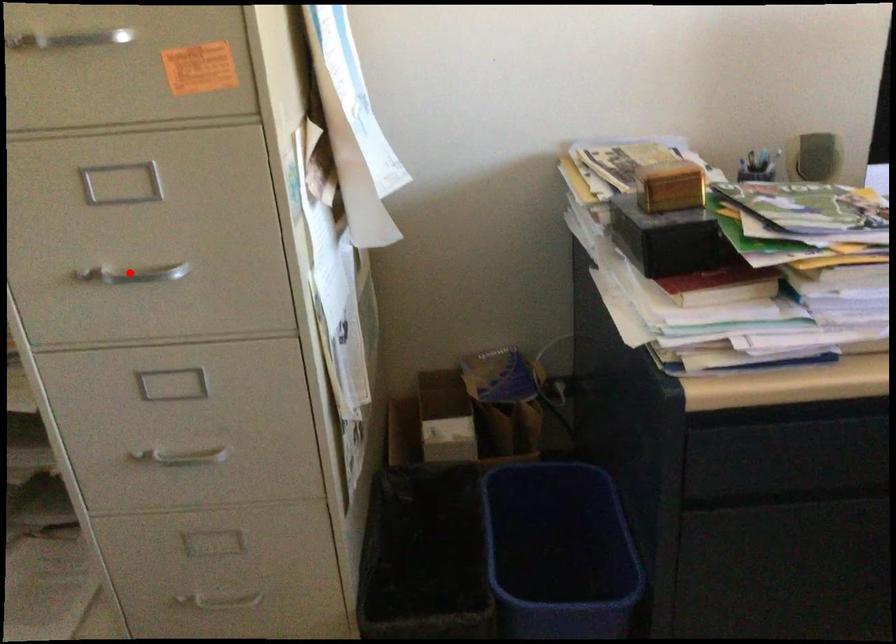
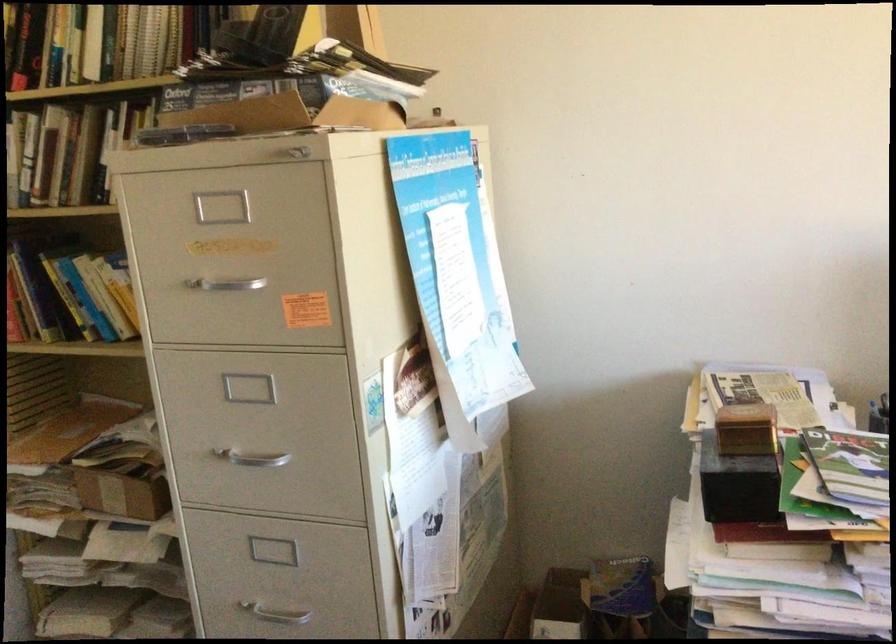
Question: A red point is marked in image1. In image2, is the corresponding 3D point closer to the camera or farther? Reply with the corresponding letter.

Choices:
 (A) The corresponding 3D point is closer.
 (B) The corresponding 3D point is farther.

Answer: (B)